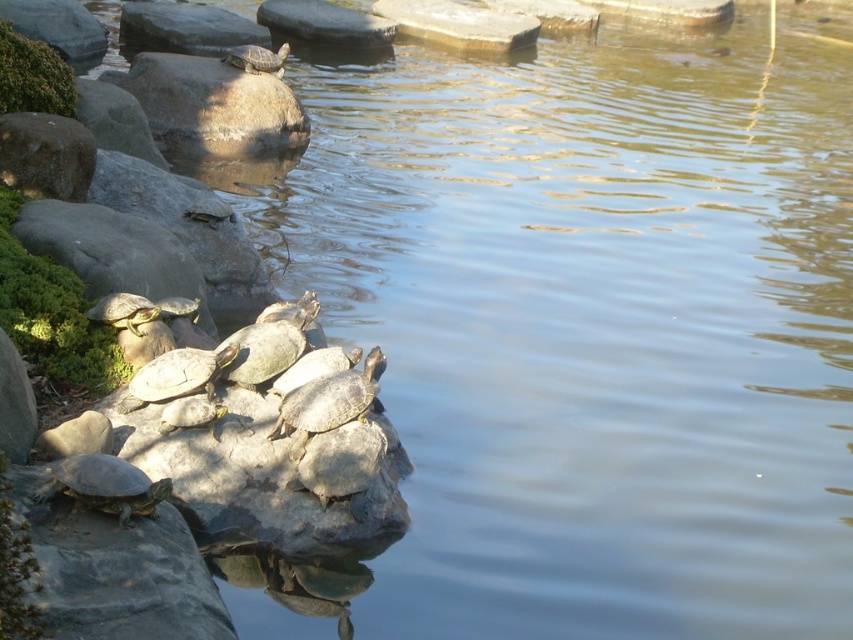
You are standing on the bank of the pond and see the brown rough rock at upper center and the smooth brown tortoise at upper center. Which object is closer to you?

The brown rough rock at upper center is closer to you because it is in front of the smooth brown tortoise at upper center.

You are standing at the edge of the pond and want to place a small decorative stone at each of the two points marked in the scene. The first point is at coordinates point (169, 84) and the second at point (131, 404). Which point is closer to you when you are facing the pond?

Point (169, 84) is closer to you because it is further to the viewer than point (131, 404), meaning it is nearer in the scene.

You are a nature photographer aiming to capture a closeup shot of the shiny green tortoise at center left and the smooth brown tortoise at upper center. Given that your camera can only focus on objects within a 30 cm width, will both tortoises fit in the frame?

The shiny green tortoise at center left has a lesser width compared to the smooth brown tortoise at upper center. Since the camera requires a 30 cm width to focus, if the smooth brown tortoise at upper center exceeds 30 cm in width, then only the smaller shiny green tortoise at center left would fit. However, without specific width measurements for both, it is impossible to confirm if both will fit within the 30 cm constraint.